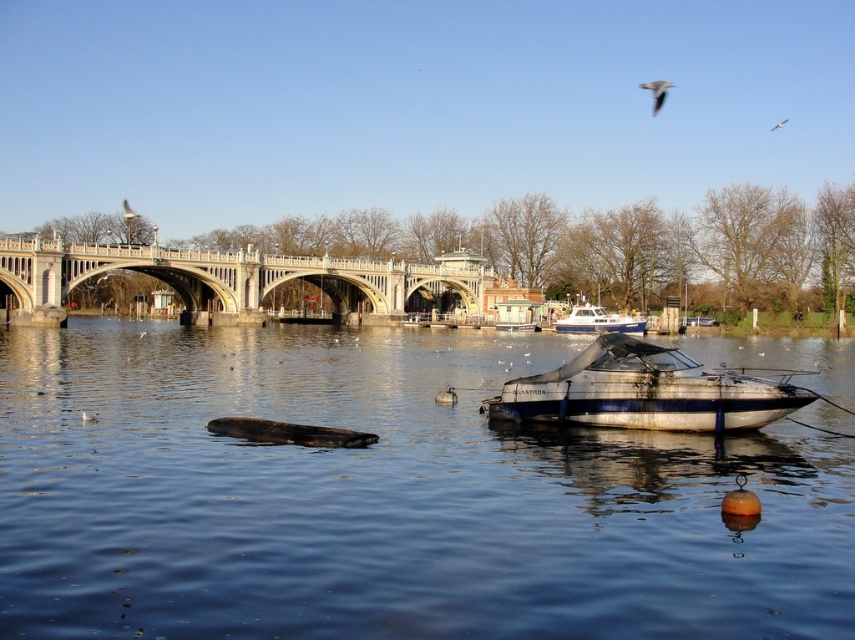
Question: Can you confirm if blue metallic boat at lower center is wider than white feathered bird at upper right?

Choices:
 (A) no
 (B) yes

Answer: (B)

Question: Is white stone bridge at center further to camera compared to white glossy boat at center?

Choices:
 (A) no
 (B) yes

Answer: (A)

Question: Which point is closer to the camera taking this photo?

Choices:
 (A) (588, 308)
 (B) (753, 348)
 (C) (478, 268)
 (D) (333, 433)

Answer: (D)

Question: Which point appears closest to the camera in this image?

Choices:
 (A) (193, 294)
 (B) (771, 128)

Answer: (A)

Question: Considering the real-world distances, which object is closest to the metallic gray boat at center?

Choices:
 (A) gray feathered bird at upper right
 (B) white feathered bird at upper left
 (C) blue metallic boat at lower center
 (D) white stone bridge at center

Answer: (C)

Question: Can you confirm if metallic gray boat at center is positioned to the right of gray feathered bird at upper right?

Choices:
 (A) no
 (B) yes

Answer: (A)